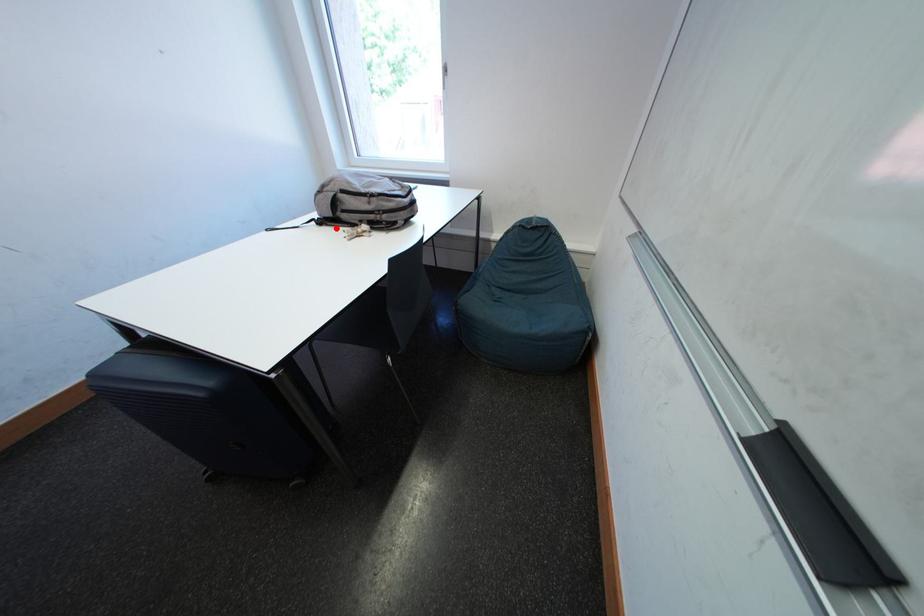
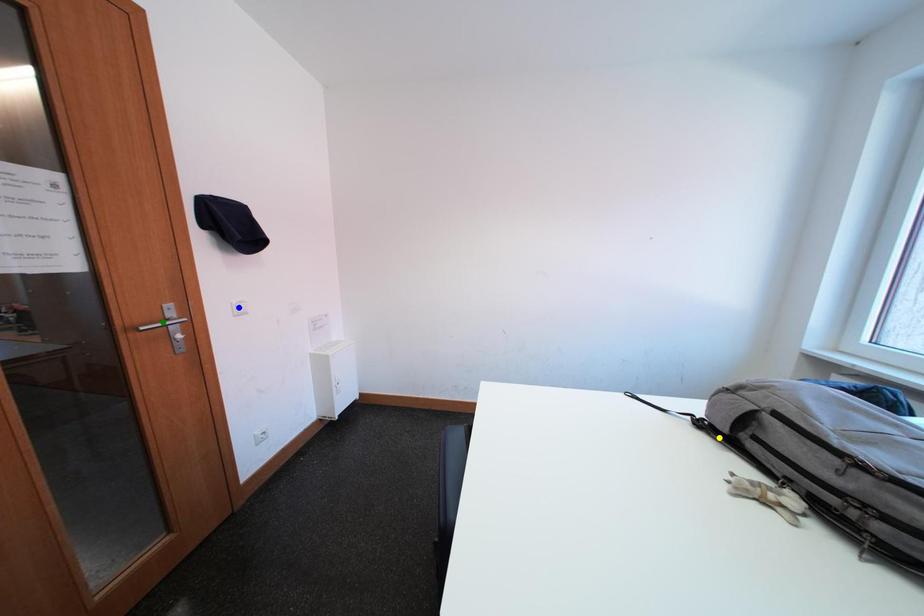
Question: I am providing you with two images of the same scene from different viewpoints. A red point is marked on the first image. You are given multiple points on the second image. In image 2, which mark is for the same physical point as the one in image 1?

Choices:
 (A) blue point
 (B) yellow point
 (C) green point

Answer: (B)